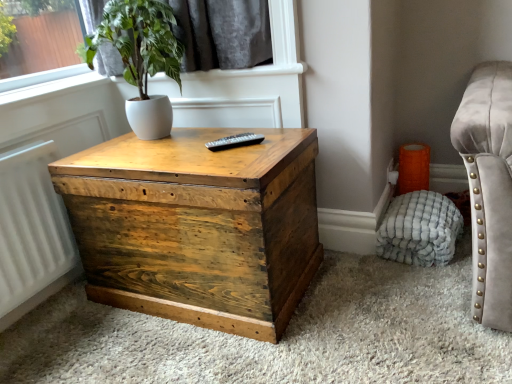
At what (x,y) coordinates should I click in order to perform the action: click on vacant area located to the right-hand side of black plastic remote at center. Please return your answer as a coordinate pair (x, y). Image resolution: width=512 pixels, height=384 pixels. Looking at the image, I should click on [271, 149].